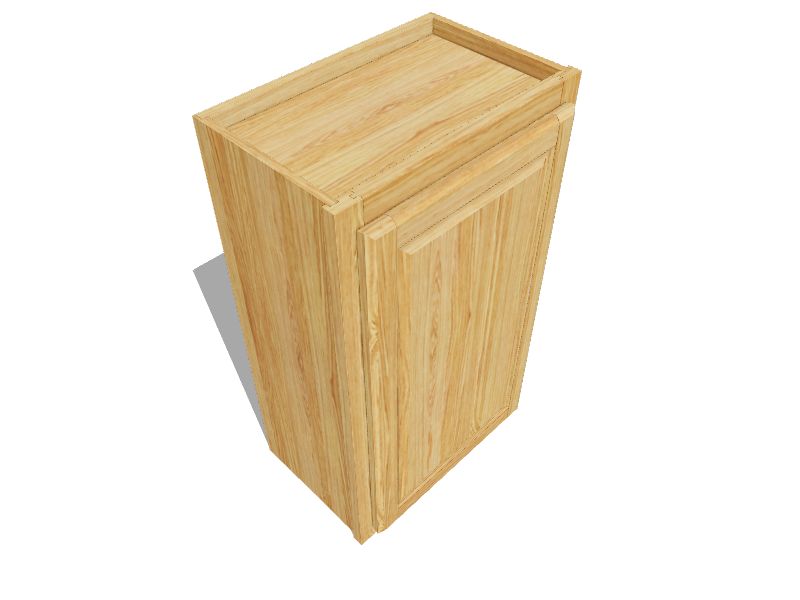
Image resolution: width=800 pixels, height=600 pixels. What are the coordinates of `top of the wood box` in the screenshot? It's located at (422, 73).